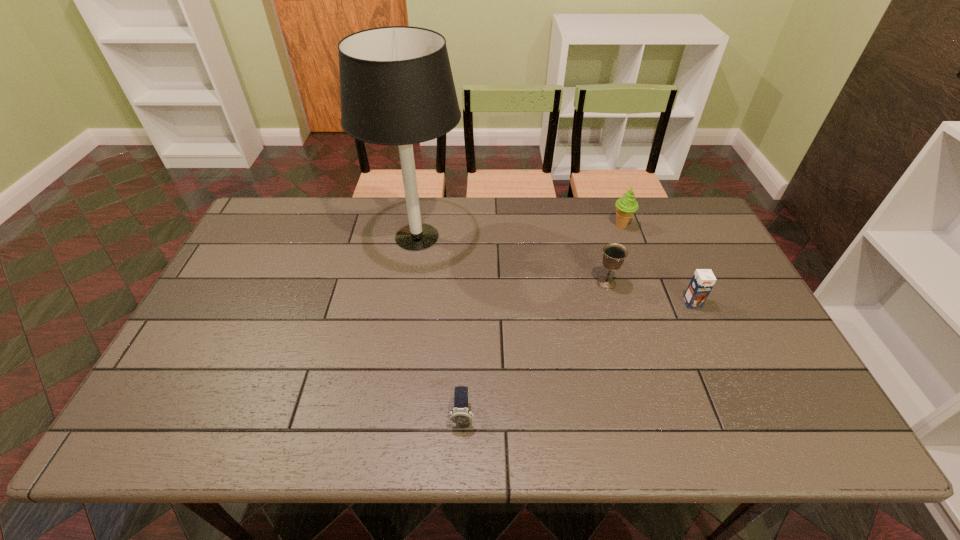
You are a GUI agent. You are given a task and a screenshot of the screen. Output one action in this format:
    pyautogui.click(x=<x>, y=<y>)
    Task: Click on the tallest object
    
    Given the screenshot: What is the action you would take?
    pyautogui.click(x=396, y=85)

Where is `the second object from right to left`? This screenshot has width=960, height=540. the second object from right to left is located at coordinates (625, 206).

I want to click on icecream, so point(625,206).

The image size is (960, 540). Find the location of `chalice`. chalice is located at coordinates (614, 254).

Identify the location of the third object from right to left. The height and width of the screenshot is (540, 960). (614, 254).

This screenshot has height=540, width=960. I want to click on the second nearest object, so click(703, 280).

This screenshot has width=960, height=540. Identify the location of chocolate milk. (703, 280).

In order to click on the nearest object in this screenshot , I will do `click(460, 414)`.

Identify the location of watch. The image size is (960, 540). (460, 414).

Find the location of a particular element. free spot located on the left of the table lamp is located at coordinates (247, 237).